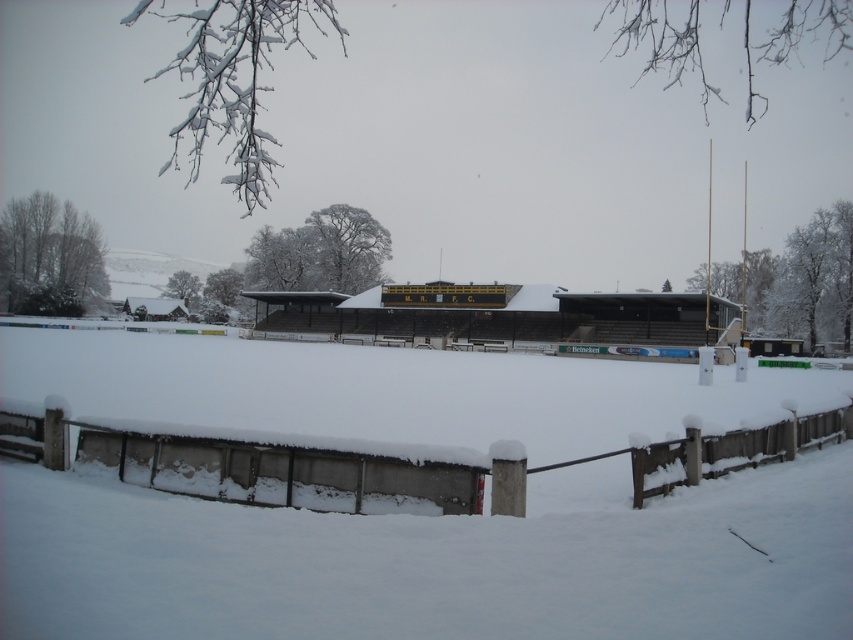
Looking at this image, does snow-covered wooden fence at lower center have a greater width compared to dark brown wooden hut at center?

Incorrect, snow-covered wooden fence at lower center's width does not surpass dark brown wooden hut at center's.

Does point (846, 413) come in front of point (595, 300)?

Yes, it is in front of point (595, 300).

At what (x,y) coordinates should I click in order to perform the action: click on snow-covered wooden fence at lower center. Please return your answer as a coordinate pair (x, y). Looking at the image, I should click on (277, 472).